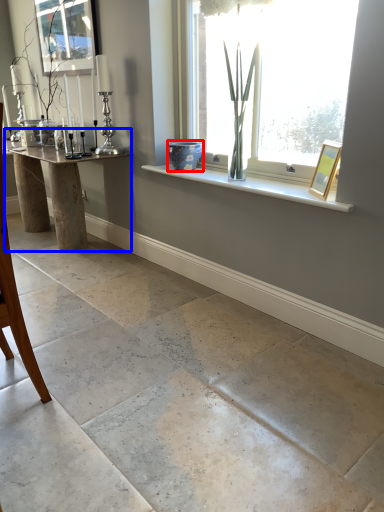
Question: Which point is further to the camera, glass vase (highlighted by a red box) or table (highlighted by a blue box)?

Choices:
 (A) glass vase
 (B) table

Answer: (B)